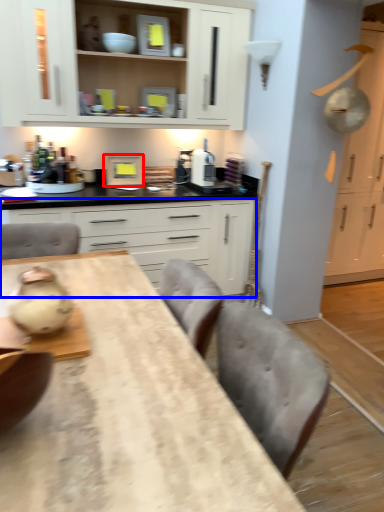
Question: Which object appears farthest to the camera in this image, appliance (highlighted by a red box) or cabinetry (highlighted by a blue box)?

Choices:
 (A) appliance
 (B) cabinetry

Answer: (A)